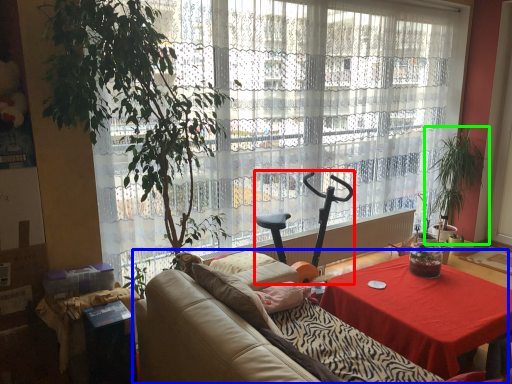
Question: Estimate the real-world distances between objects in this image. Which object is closer to swivel chair (highlighted by a red box), studio couch (highlighted by a blue box) or houseplant (highlighted by a green box)?

Choices:
 (A) studio couch
 (B) houseplant

Answer: (A)